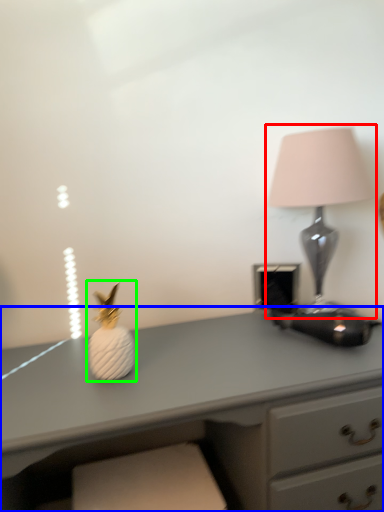
Question: Which object is the closest to the lamp (highlighted by a red box)? Choose among these: desk (highlighted by a blue box) or miniature (highlighted by a green box).

Choices:
 (A) desk
 (B) miniature

Answer: (A)